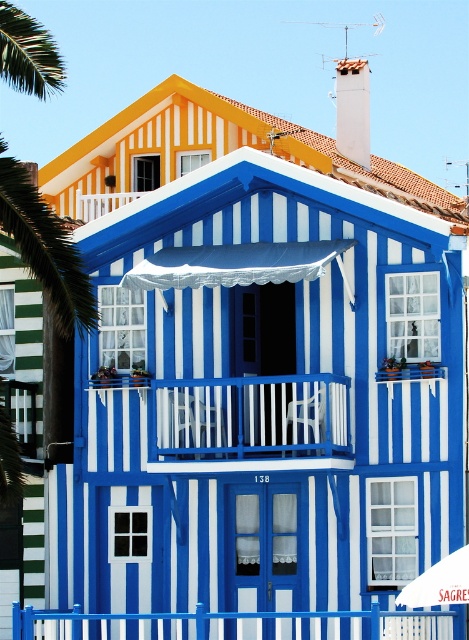
Which is behind, point (216, 548) or point (218, 612)?

The point (216, 548) is more distant.

Is the position of blue striped house at center less distant than that of blue painted metal fence at lower center?

No, it is behind blue painted metal fence at lower center.

Is point (143, 337) farther from viewer compared to point (422, 618)?

Yes, point (143, 337) is behind point (422, 618).

Find the location of a particular element. blue striped house at center is located at coordinates (262, 397).

Consider the image. Is blue striped house at center to the left of green leafy palm tree at left from the viewer's perspective?

In fact, blue striped house at center is to the right of green leafy palm tree at left.

Does blue striped house at center have a lesser height compared to green leafy palm tree at left?

No, blue striped house at center is not shorter than green leafy palm tree at left.

Between point (171, 216) and point (22, 86), which one is positioned behind?

The point (171, 216) is more distant.

You are a GUI agent. You are given a task and a screenshot of the screen. Output one action in this format:
    pyautogui.click(x=<x>, y=<y>)
    Task: Click on the blue striped house at center
    The image size is (469, 640).
    Given the screenshot: What is the action you would take?
    pyautogui.click(x=262, y=397)

Can you confirm if green leafy palm tree at left is bigger than white fabric umbrella at center?

Correct, green leafy palm tree at left is larger in size than white fabric umbrella at center.

The image size is (469, 640). What do you see at coordinates (45, 248) in the screenshot?
I see `green leafy palm tree at left` at bounding box center [45, 248].

At what (x,y) coordinates should I click in order to perform the action: click on green leafy palm tree at left. Please return your answer as a coordinate pair (x, y). This screenshot has width=469, height=640. Looking at the image, I should click on (45, 248).